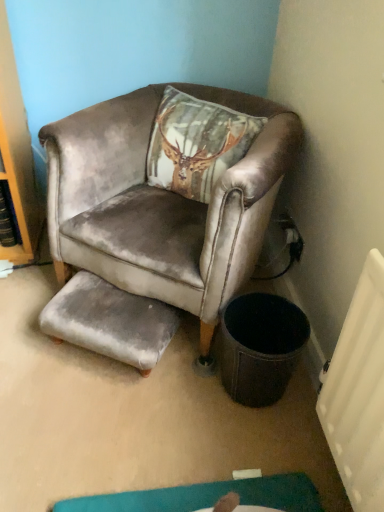
Find the location of a particular element. free space in front of velvet brown armchair at upper center is located at coordinates (134, 423).